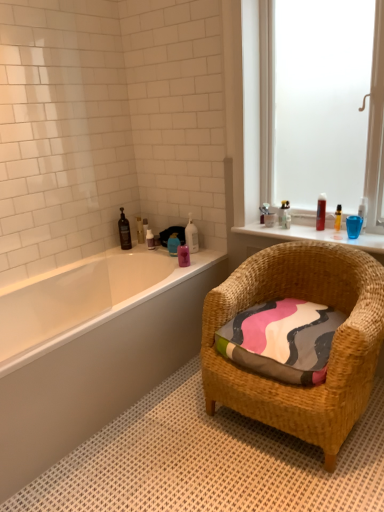
Question: From a real-world perspective, is shiny brown bottle at left, which ranks as the first toiletry in left-to-right order, positioned over clear plastic bottle at upper right, which is the eighth toiletry in left-to-right order, based on gravity?

Choices:
 (A) yes
 (B) no

Answer: (B)

Question: Considering the relative sizes of shiny brown bottle at left, marked as the tenth toiletry in a right-to-left arrangement, and clear plastic bottle at upper right, which is the eighth toiletry in left-to-right order, in the image provided, is shiny brown bottle at left, marked as the tenth toiletry in a right-to-left arrangement, shorter than clear plastic bottle at upper right, which is the eighth toiletry in left-to-right order,?

Choices:
 (A) no
 (B) yes

Answer: (A)

Question: Is shiny brown bottle at left, marked as the tenth toiletry in a right-to-left arrangement, oriented towards clear plastic bottle at upper right, the 3th toiletry from the right?

Choices:
 (A) yes
 (B) no

Answer: (B)

Question: From the image's perspective, is shiny brown bottle at left, marked as the tenth toiletry in a right-to-left arrangement, located above clear plastic bottle at upper right, which is the eighth toiletry in left-to-right order?

Choices:
 (A) no
 (B) yes

Answer: (A)

Question: Are shiny brown bottle at left, marked as the tenth toiletry in a right-to-left arrangement, and clear plastic bottle at upper right, the 3th toiletry from the right, making contact?

Choices:
 (A) yes
 (B) no

Answer: (B)

Question: Considering the relative positions of transparent glass window at upper right and translucent plastic soap dispenser at upper left, the second toiletry when ordered from left to right, in the image provided, is transparent glass window at upper right to the left or to the right of translucent plastic soap dispenser at upper left, the second toiletry when ordered from left to right,?

Choices:
 (A) right
 (B) left

Answer: (A)

Question: Is transparent glass window at upper right bigger or smaller than translucent plastic soap dispenser at upper left, the second toiletry when ordered from left to right?

Choices:
 (A) small
 (B) big

Answer: (B)

Question: In terms of height, does transparent glass window at upper right look taller or shorter compared to translucent plastic soap dispenser at upper left, the second toiletry when ordered from left to right?

Choices:
 (A) tall
 (B) short

Answer: (A)

Question: Considering the positions of transparent glass window at upper right and translucent plastic soap dispenser at upper left, the second toiletry when ordered from left to right, in the image, is transparent glass window at upper right wider or thinner than translucent plastic soap dispenser at upper left, the second toiletry when ordered from left to right,?

Choices:
 (A) wide
 (B) thin

Answer: (A)

Question: From a real-world perspective, relative to translucent plastic soap dispenser at upper center, the fourth toiletry from the left, is clear plastic bottle at upper right, which is the eighth toiletry in left-to-right order, vertically above or below?

Choices:
 (A) above
 (B) below

Answer: (A)

Question: In terms of height, does clear plastic bottle at upper right, which is the eighth toiletry in left-to-right order, look taller or shorter compared to translucent plastic soap dispenser at upper center, acting as the seventh toiletry starting from the right?

Choices:
 (A) short
 (B) tall

Answer: (A)

Question: In terms of size, does clear plastic bottle at upper right, which is the eighth toiletry in left-to-right order, appear bigger or smaller than translucent plastic soap dispenser at upper center, acting as the seventh toiletry starting from the right?

Choices:
 (A) big
 (B) small

Answer: (A)

Question: Does point (266, 205) appear closer or farther from the camera than point (147, 240)?

Choices:
 (A) closer
 (B) farther

Answer: (A)

Question: Considering the positions of clear plastic bottle at upper right, the second toiletry positioned from the right, and clear plastic bottle at upper right, which is the eighth toiletry in left-to-right order, in the image, is clear plastic bottle at upper right, the second toiletry positioned from the right, taller or shorter than clear plastic bottle at upper right, which is the eighth toiletry in left-to-right order,?

Choices:
 (A) tall
 (B) short

Answer: (A)

Question: Looking at their shapes, would you say clear plastic bottle at upper right, the second toiletry positioned from the right, is wider or thinner than clear plastic bottle at upper right, which is the eighth toiletry in left-to-right order?

Choices:
 (A) wide
 (B) thin

Answer: (A)